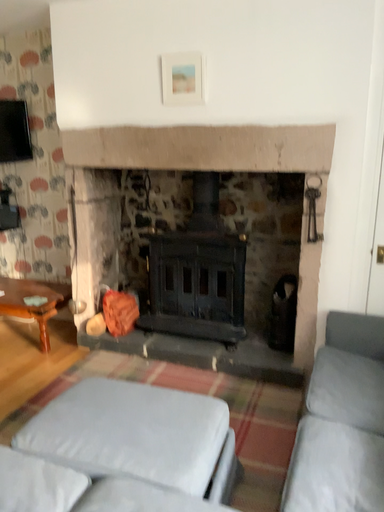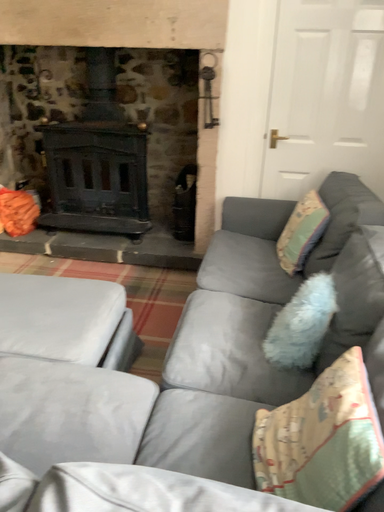
Question: How did the camera likely rotate when shooting the video?

Choices:
 (A) rotated left
 (B) rotated right

Answer: (B)